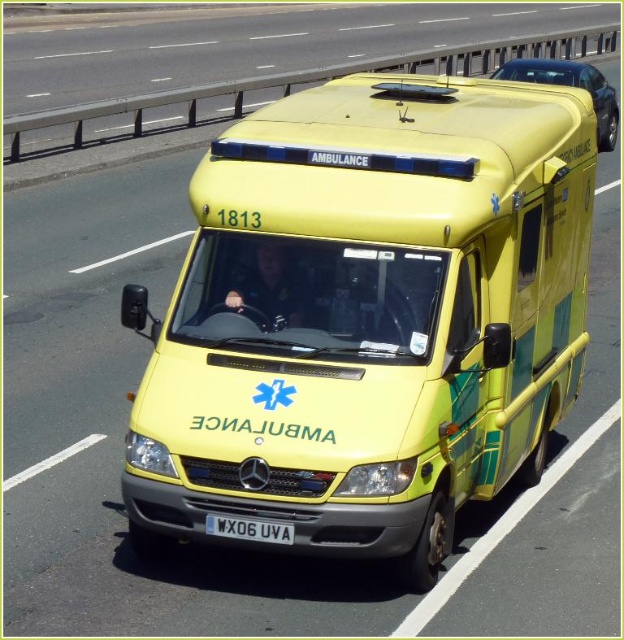
Can you confirm if yellow matte ambulance at upper center is thinner than white plastic license plate at center?

Incorrect, yellow matte ambulance at upper center's width is not less than white plastic license plate at center's.

Which is more to the left, yellow matte ambulance at upper center or white plastic license plate at center?

white plastic license plate at center is more to the left.

Find the location of a particular element. Image resolution: width=624 pixels, height=640 pixels. yellow matte ambulance at upper center is located at coordinates (570, 84).

Is point (427, 160) positioned behind point (608, 136)?

No.

Is yellow matte ambulance at center taller than yellow matte ambulance at upper center?

No, yellow matte ambulance at center is not taller than yellow matte ambulance at upper center.

In the scene shown: Who is more distant from viewer, (524, 184) or (602, 131)?

Positioned behind is point (602, 131).

Where is `yellow matte ambulance at center`? Image resolution: width=624 pixels, height=640 pixels. yellow matte ambulance at center is located at coordinates (368, 316).

Who is higher up, yellow matte ambulance at center or white plastic license plate at center?

yellow matte ambulance at center is higher up.

Between yellow matte ambulance at center and white plastic license plate at center, which one has less height?

With less height is white plastic license plate at center.

Find the location of a particular element. This screenshot has width=624, height=640. yellow matte ambulance at center is located at coordinates (368, 316).

Image resolution: width=624 pixels, height=640 pixels. I want to click on yellow matte ambulance at center, so click(368, 316).